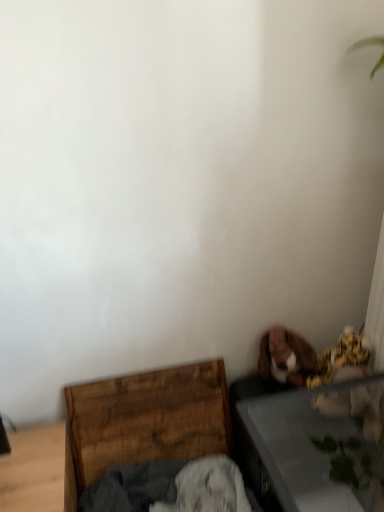
Question: Is wooden chest at lower left bigger than transparent glass table at lower right?

Choices:
 (A) yes
 (B) no

Answer: (B)

Question: From a real-world perspective, is wooden chest at lower left below transparent glass table at lower right?

Choices:
 (A) yes
 (B) no

Answer: (A)

Question: Is wooden chest at lower left behind transparent glass table at lower right?

Choices:
 (A) yes
 (B) no

Answer: (A)

Question: Is wooden chest at lower left aimed at transparent glass table at lower right?

Choices:
 (A) no
 (B) yes

Answer: (B)

Question: Is wooden chest at lower left wider than transparent glass table at lower right?

Choices:
 (A) yes
 (B) no

Answer: (B)

Question: Can you confirm if wooden chest at lower left is positioned to the left of transparent glass table at lower right?

Choices:
 (A) yes
 (B) no

Answer: (A)

Question: From the image's perspective, would you say transparent glass table at lower right is shown under dark gray cotton cloth at lower center?

Choices:
 (A) yes
 (B) no

Answer: (B)

Question: From a real-world perspective, is transparent glass table at lower right located beneath dark gray cotton cloth at lower center?

Choices:
 (A) yes
 (B) no

Answer: (B)

Question: Is transparent glass table at lower right oriented away from dark gray cotton cloth at lower center?

Choices:
 (A) no
 (B) yes

Answer: (A)

Question: Can you confirm if transparent glass table at lower right is wider than dark gray cotton cloth at lower center?

Choices:
 (A) yes
 (B) no

Answer: (A)

Question: Is transparent glass table at lower right taller than dark gray cotton cloth at lower center?

Choices:
 (A) no
 (B) yes

Answer: (B)

Question: Considering the relative sizes of transparent glass table at lower right and dark gray cotton cloth at lower center in the image provided, is transparent glass table at lower right shorter than dark gray cotton cloth at lower center?

Choices:
 (A) no
 (B) yes

Answer: (A)

Question: Is dark gray cotton cloth at lower center at the left side of transparent glass table at lower right?

Choices:
 (A) yes
 (B) no

Answer: (A)